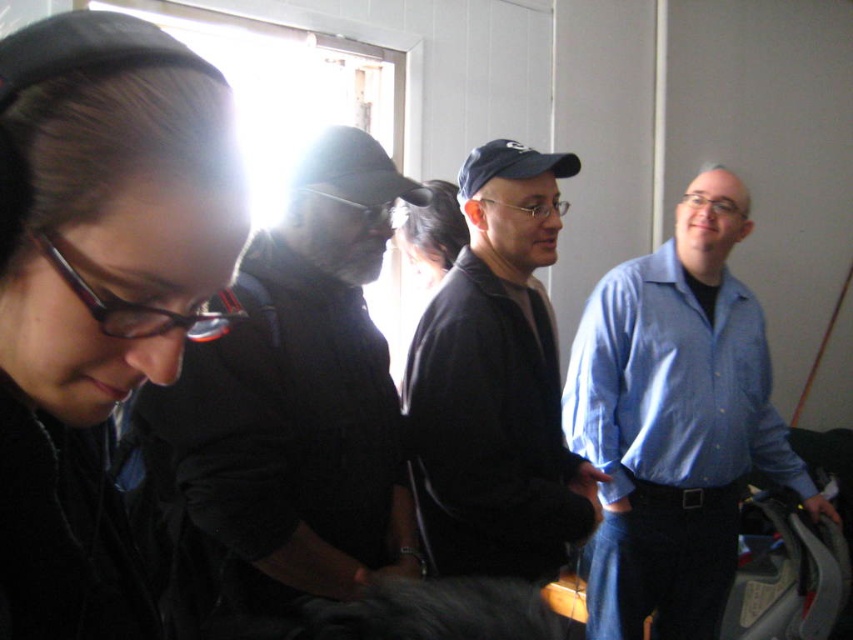
You are taking a photo of the two caps in the image. The dark blue cap at center and the black fabric baseball cap at center. Which one should you focus on first if you want to capture both clearly in your photo?

The dark blue cap at center is located below the black fabric baseball cap at center, so you should focus on the black fabric baseball cap at center first since it is higher up and closer to the camera.

You are trying to identify clothing items in the image. Which clothing item is taller between the blue shirt at right and the dark blue cap at center?

The blue shirt at right is taller than the dark blue cap at center.